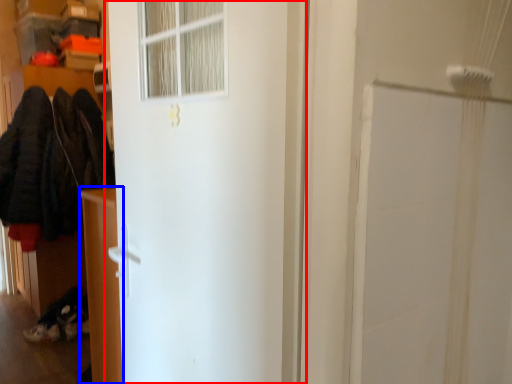
Question: Which point is closer to the camera, door (highlighted by a red box) or furniture (highlighted by a blue box)?

Choices:
 (A) door
 (B) furniture

Answer: (A)